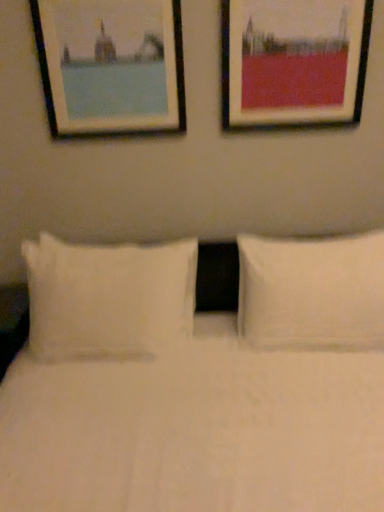
Question: Can matte black picture frame at upper right, the first picture frame viewed from the right, be found inside white soft pillow at left, which is the second pillow in right-to-left order?

Choices:
 (A) no
 (B) yes

Answer: (A)

Question: Is white soft pillow at left, which is the second pillow in right-to-left order, not within matte black picture frame at upper right, the second picture frame in the left-to-right sequence?

Choices:
 (A) no
 (B) yes

Answer: (B)

Question: Can you confirm if white soft pillow at left, which is the second pillow in right-to-left order, is taller than matte black picture frame at upper right, the second picture frame in the left-to-right sequence?

Choices:
 (A) yes
 (B) no

Answer: (A)

Question: Can you confirm if white soft pillow at left, the first pillow viewed from the left, is positioned to the right of matte black picture frame at upper right, the first picture frame viewed from the right?

Choices:
 (A) no
 (B) yes

Answer: (A)

Question: Is white soft pillow at left, the first pillow viewed from the left, thinner than matte black picture frame at upper right, the second picture frame in the left-to-right sequence?

Choices:
 (A) no
 (B) yes

Answer: (A)

Question: Does point (236, 4) appear closer or farther from the camera than point (44, 350)?

Choices:
 (A) closer
 (B) farther

Answer: (A)

Question: Choose the correct answer: Is matte black picture frame at upper right, the first picture frame viewed from the right, inside white soft pillow at left, the first pillow viewed from the left, or outside it?

Choices:
 (A) inside
 (B) outside

Answer: (B)

Question: Based on their positions, is matte black picture frame at upper right, the first picture frame viewed from the right, located to the left or right of white soft pillow at left, which is the second pillow in right-to-left order?

Choices:
 (A) right
 (B) left

Answer: (A)

Question: From the image's perspective, is matte black picture frame at upper right, the first picture frame viewed from the right, positioned above or below white soft pillow at left, which is the second pillow in right-to-left order?

Choices:
 (A) above
 (B) below

Answer: (A)

Question: From a real-world perspective, is matte black picture frame at upper right, the second picture frame in the left-to-right sequence, physically located above or below wooden frame at upper left, marked as the second picture frame in a right-to-left arrangement?

Choices:
 (A) above
 (B) below

Answer: (B)

Question: From the image's perspective, relative to wooden frame at upper left, marked as the second picture frame in a right-to-left arrangement, is matte black picture frame at upper right, the first picture frame viewed from the right, above or below?

Choices:
 (A) below
 (B) above

Answer: (B)

Question: Do you think matte black picture frame at upper right, the second picture frame in the left-to-right sequence, is within wooden frame at upper left, marked as the second picture frame in a right-to-left arrangement, or outside of it?

Choices:
 (A) inside
 (B) outside

Answer: (B)

Question: Relative to wooden frame at upper left, which is the 1th picture frame from left to right, is matte black picture frame at upper right, the first picture frame viewed from the right, in front or behind?

Choices:
 (A) behind
 (B) front

Answer: (B)

Question: From the image's perspective, is white soft pillow at left, the first pillow viewed from the left, above or below wooden frame at upper left, marked as the second picture frame in a right-to-left arrangement?

Choices:
 (A) above
 (B) below

Answer: (B)

Question: Based on their sizes in the image, would you say white soft pillow at left, which is the second pillow in right-to-left order, is bigger or smaller than wooden frame at upper left, which is the 1th picture frame from left to right?

Choices:
 (A) small
 (B) big

Answer: (B)